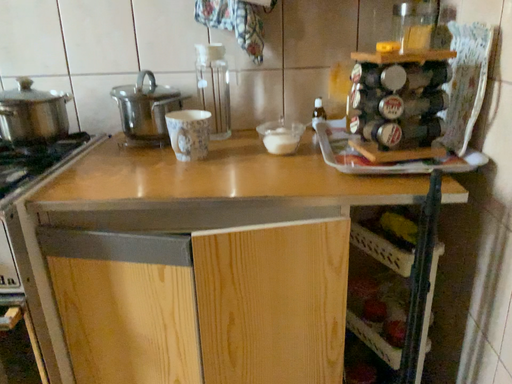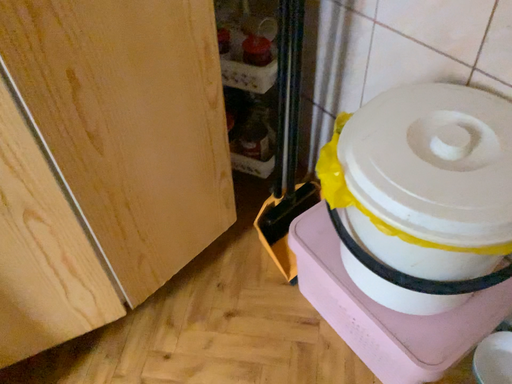
Question: Which way did the camera rotate in the video?

Choices:
 (A) rotated downward
 (B) rotated upward

Answer: (A)